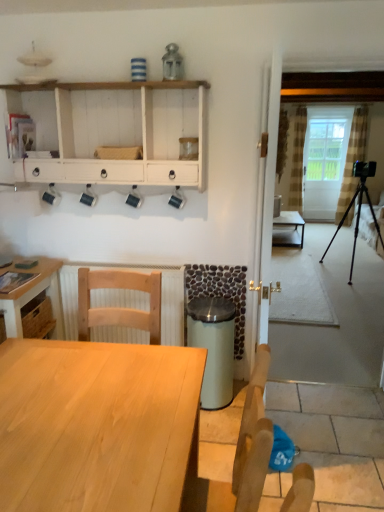
Question: From the image's perspective, is matte black table at center, placed as the 3th table when sorted from bottom to top, located above or below light wood table at lower left, the second table in the top-to-bottom sequence?

Choices:
 (A) below
 (B) above

Answer: (B)

Question: In terms of size, does matte black table at center, the 3th table when ordered from front to back, appear bigger or smaller than light wood table at lower left, the second table positioned from the back?

Choices:
 (A) small
 (B) big

Answer: (A)

Question: Which is nearer to the light wood chair at lower left?

Choices:
 (A) white wood shelf at upper left
 (B) black metal tripod at right
 (C) white glass screen door at center
 (D) light wood table at lower left, which is counted as the third table, starting from the right
 (E) matte black table at center, the first table when ordered from top to bottom

Answer: (D)

Question: Estimate the real-world distances between objects in this image. Which object is farther from the white wood shelf at upper left?

Choices:
 (A) black metal tripod at right
 (B) light wood table at lower left, placed as the 1th table when sorted from bottom to top
 (C) matte black table at center, the 3th table when ordered from front to back
 (D) light wood chair at lower left
 (E) white glass screen door at center

Answer: (E)